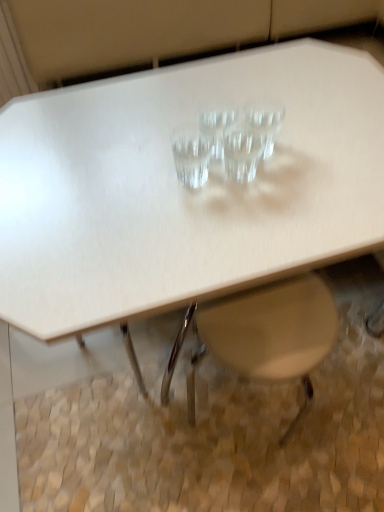
The image size is (384, 512). I want to click on free space in front of transparent glass martini at center, which is the 3th martini glass in left-to-right order, so click(x=245, y=226).